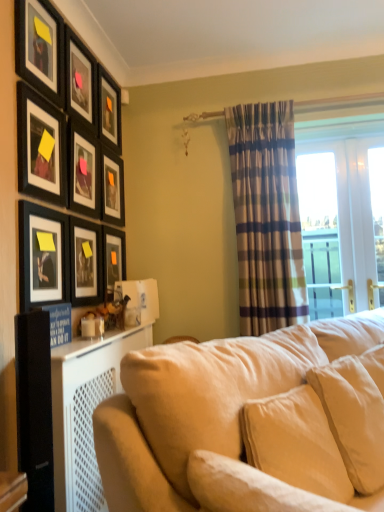
Where is `beige fabric couch at lower right`? The height and width of the screenshot is (512, 384). beige fabric couch at lower right is located at coordinates (246, 421).

Measure the distance between matte black picture frame at upper left, acting as the first picture frame starting from the top, and camera.

1.61 meters.

Describe the element at coordinates (266, 217) in the screenshot. This screenshot has height=512, width=384. I see `plaid fabric curtain at right` at that location.

Describe the element at coordinates (112, 188) in the screenshot. Image resolution: width=384 pixels, height=512 pixels. I see `matte black picture frame at upper left, acting as the 4th picture frame starting from the bottom` at that location.

Image resolution: width=384 pixels, height=512 pixels. In order to click on matte black picture frame at left, the 7th picture frame viewed from the top in this screenshot , I will do `click(43, 256)`.

Locate an element on the screen. beige fabric couch at lower right is located at coordinates pos(246,421).

From the image's perspective, is matte black picture frame at upper left, acting as the 6th picture frame starting from the top, above matte black picture frame at upper left, which is the eighth picture frame in bottom-to-top order?

No, from the image's perspective, matte black picture frame at upper left, acting as the 6th picture frame starting from the top, is not on top of matte black picture frame at upper left, which is the eighth picture frame in bottom-to-top order.

Is point (117, 186) positioned after point (76, 63)?

Yes, point (117, 186) is farther from viewer.

Could you tell me if matte black picture frame at upper left, acting as the 6th picture frame starting from the top, is turned towards matte black picture frame at upper left, which is the eighth picture frame in bottom-to-top order?

No, matte black picture frame at upper left, acting as the 6th picture frame starting from the top, is not turned towards matte black picture frame at upper left, which is the eighth picture frame in bottom-to-top order.

Who is shorter, matte black picture frame at upper left, the 9th picture frame ordered from the bottom, or matte black picture frame at upper left, the 1th picture frame in the bottom-to-top sequence?

Standing shorter between the two is matte black picture frame at upper left, the 9th picture frame ordered from the bottom.

Between matte black picture frame at upper left, the 9th picture frame ordered from the bottom, and matte black picture frame at upper left, positioned as the ninth picture frame in top-to-bottom order, which one has larger width?

With larger width is matte black picture frame at upper left, the 9th picture frame ordered from the bottom.

Who is bigger, matte black picture frame at upper left, acting as the first picture frame starting from the top, or matte black picture frame at upper left, positioned as the ninth picture frame in top-to-bottom order?

With larger size is matte black picture frame at upper left, acting as the first picture frame starting from the top.

Is there a large distance between beige fabric couch at lower right and matte black picture frame at left, the 8th picture frame viewed from the top?

Yes, beige fabric couch at lower right and matte black picture frame at left, the 8th picture frame viewed from the top, are located far from each other.

Is beige fabric couch at lower right bigger than matte black picture frame at left, acting as the 2th picture frame starting from the bottom?

Correct, beige fabric couch at lower right is larger in size than matte black picture frame at left, acting as the 2th picture frame starting from the bottom.

Between point (234, 352) and point (96, 231), which one is positioned behind?

The point (96, 231) is farther from the camera.

Measure the distance from beige fabric couch at lower right to matte black picture frame at left, the 8th picture frame viewed from the top.

beige fabric couch at lower right is 3.71 feet away from matte black picture frame at left, the 8th picture frame viewed from the top.

Which object is positioned more to the right, matte black picture frame at left, acting as the 2th picture frame starting from the bottom, or matte black picture frame at upper left, the 9th picture frame ordered from the bottom?

matte black picture frame at left, acting as the 2th picture frame starting from the bottom.

Is matte black picture frame at left, the 8th picture frame viewed from the top, thinner than matte black picture frame at upper left, acting as the first picture frame starting from the top?

Yes, matte black picture frame at left, the 8th picture frame viewed from the top, is thinner than matte black picture frame at upper left, acting as the first picture frame starting from the top.

Is matte black picture frame at left, the 8th picture frame viewed from the top, taller or shorter than matte black picture frame at upper left, the 9th picture frame ordered from the bottom?

matte black picture frame at left, the 8th picture frame viewed from the top, is taller than matte black picture frame at upper left, the 9th picture frame ordered from the bottom.

Would you say matte black picture frame at upper left, the fourth picture frame when ordered from top to bottom, is a long distance from beige fabric pillow at lower right, which is counted as the 2th pillow, starting from the back?

Yes, matte black picture frame at upper left, the fourth picture frame when ordered from top to bottom, and beige fabric pillow at lower right, which is counted as the 2th pillow, starting from the back, are quite far apart.

From their relative heights in the image, would you say matte black picture frame at upper left, which is counted as the sixth picture frame, starting from the bottom, is taller or shorter than beige fabric pillow at lower right, which is counted as the 2th pillow, starting from the back?

In the image, matte black picture frame at upper left, which is counted as the sixth picture frame, starting from the bottom, appears to be taller than beige fabric pillow at lower right, which is counted as the 2th pillow, starting from the back.

Consider the image. Could you tell me if matte black picture frame at upper left, which is counted as the sixth picture frame, starting from the bottom, is facing beige fabric pillow at lower right, acting as the 1th pillow starting from the front?

No, matte black picture frame at upper left, which is counted as the sixth picture frame, starting from the bottom, is not facing towards beige fabric pillow at lower right, acting as the 1th pillow starting from the front.

What's the angular difference between matte black picture frame at upper left, which is counted as the sixth picture frame, starting from the bottom, and beige fabric pillow at lower right, acting as the 1th pillow starting from the front,'s facing directions?

The angular difference between matte black picture frame at upper left, which is counted as the sixth picture frame, starting from the bottom, and beige fabric pillow at lower right, acting as the 1th pillow starting from the front, is 53.5 degrees.

Are matte black picture frame at upper left, the fourth picture frame when ordered from top to bottom, and matte black picture frame at upper left, the fifth picture frame positioned from the top, beside each other?

They are not placed beside each other.

Does matte black picture frame at upper left, which is counted as the sixth picture frame, starting from the bottom, have a larger size compared to matte black picture frame at upper left, the 5th picture frame from the bottom?

No, matte black picture frame at upper left, which is counted as the sixth picture frame, starting from the bottom, is not bigger than matte black picture frame at upper left, the 5th picture frame from the bottom.

How many degrees apart are the facing directions of matte black picture frame at upper left, which is counted as the sixth picture frame, starting from the bottom, and matte black picture frame at upper left, the fifth picture frame positioned from the top?

The angular difference between matte black picture frame at upper left, which is counted as the sixth picture frame, starting from the bottom, and matte black picture frame at upper left, the fifth picture frame positioned from the top, is 0.0139 degrees.

From a real-world perspective, is matte black picture frame at upper left, which is counted as the sixth picture frame, starting from the bottom, physically above matte black picture frame at upper left, the 5th picture frame from the bottom?

No, from a real-world perspective, matte black picture frame at upper left, which is counted as the sixth picture frame, starting from the bottom, is not over matte black picture frame at upper left, the 5th picture frame from the bottom

Would you say matte black picture frame at upper left, the 7th picture frame when ordered from bottom to top, is to the left or to the right of plaid fabric curtain at right in the picture?

Clearly, matte black picture frame at upper left, the 7th picture frame when ordered from bottom to top, is on the left of plaid fabric curtain at right in the image.

Considering the relative sizes of matte black picture frame at upper left, the third picture frame positioned from the top, and plaid fabric curtain at right in the image provided, is matte black picture frame at upper left, the third picture frame positioned from the top, shorter than plaid fabric curtain at right?

Correct, matte black picture frame at upper left, the third picture frame positioned from the top, is not as tall as plaid fabric curtain at right.

Which picture frame is the 3rd one when counting from the left side of the plaid fabric curtain at right? Please provide its 2D coordinates.

[(109, 110)]

The height and width of the screenshot is (512, 384). I want to click on the 4th picture frame counting from the right side of the matte black picture frame at upper left, which appears as the 2th picture frame when viewed from the top, so click(112, 188).

Starting from the matte black picture frame at upper left, the 1th picture frame in the bottom-to-top sequence, which picture frame is the 8th one to the left? Please provide its 2D coordinates.

[(40, 48)]

Considering their positions, is matte black picture frame at upper left, the fifth picture frame positioned from the top, positioned further to plaid fabric curtain at right than beige velvety pillow at center, which is the 1th pillow in back-to-front order?

Among the two, beige velvety pillow at center, which is the 1th pillow in back-to-front order, is located further to plaid fabric curtain at right.

Looking at the image, which one is located closer to matte black picture frame at left, the 7th picture frame viewed from the top, matte black picture frame at upper left, the third picture frame positioned from the top, or matte black picture frame at upper left, acting as the 6th picture frame starting from the top?

matte black picture frame at upper left, acting as the 6th picture frame starting from the top.

When comparing their distances from matte black picture frame at left, the 8th picture frame viewed from the top, does matte black picture frame at upper left, which appears as the 2th picture frame when viewed from the top, or matte black picture frame at upper left, the 9th picture frame ordered from the bottom, seem further?

Based on the image, matte black picture frame at upper left, the 9th picture frame ordered from the bottom, appears to be further to matte black picture frame at left, the 8th picture frame viewed from the top.

Which object lies further to the anchor point matte black picture frame at upper left, acting as the 6th picture frame starting from the top, matte black picture frame at upper left, acting as the first picture frame starting from the top, or plaid fabric curtain at right?

The object further to matte black picture frame at upper left, acting as the 6th picture frame starting from the top, is plaid fabric curtain at right.

Based on their spatial positions, is matte black picture frame at left, the 7th picture frame viewed from the top, or matte black picture frame at upper left, which appears as the 2th picture frame when viewed from the top, closer to matte black picture frame at upper left, acting as the 6th picture frame starting from the top?

Based on the image, matte black picture frame at upper left, which appears as the 2th picture frame when viewed from the top, appears to be nearer to matte black picture frame at upper left, acting as the 6th picture frame starting from the top.

Looking at the image, which one is located further to plaid fabric curtain at right, matte black picture frame at upper left, the 9th picture frame ordered from the bottom, or beige fabric pillow at lower right, acting as the 1th pillow starting from the front?

beige fabric pillow at lower right, acting as the 1th pillow starting from the front.

Which object lies nearer to the anchor point matte black picture frame at upper left, the fifth picture frame positioned from the top, matte black picture frame at upper left, which is the eighth picture frame in bottom-to-top order, or matte black picture frame at upper left, the 1th picture frame in the bottom-to-top sequence?

Among the two, matte black picture frame at upper left, which is the eighth picture frame in bottom-to-top order, is located nearer to matte black picture frame at upper left, the fifth picture frame positioned from the top.

Which object lies nearer to the anchor point matte black picture frame at upper left, the third picture frame positioned from the top, matte black picture frame at upper left, acting as the 4th picture frame starting from the bottom, or matte black picture frame at upper left, which is the eighth picture frame in bottom-to-top order?

Among the two, matte black picture frame at upper left, which is the eighth picture frame in bottom-to-top order, is located nearer to matte black picture frame at upper left, the third picture frame positioned from the top.

Where is `pillow between matte black picture frame at upper left, which is the eighth picture frame in bottom-to-top order, and beige velvety pillow at center, which is the 1th pillow in back-to-front order, in the vertical direction`? Image resolution: width=384 pixels, height=512 pixels. pillow between matte black picture frame at upper left, which is the eighth picture frame in bottom-to-top order, and beige velvety pillow at center, which is the 1th pillow in back-to-front order, in the vertical direction is located at coordinates (248, 488).

Image resolution: width=384 pixels, height=512 pixels. In order to click on curtain that lies between matte black picture frame at upper left, the 9th picture frame ordered from the bottom, and beige velvety pillow at center, positioned as the 2th pillow in front-to-back order, from top to bottom in this screenshot , I will do `click(266, 217)`.

At what (x,y) coordinates should I click in order to perform the action: click on pillow between matte black picture frame at left, the 7th picture frame viewed from the top, and beige velvety pillow at center, positioned as the 2th pillow in front-to-back order, from left to right. Please return your answer as a coordinate pair (x, y). Looking at the image, I should click on (248, 488).

Where is `curtain located between beige velvety pillow at center, which is the 1th pillow in back-to-front order, and matte black picture frame at upper left, the 7th picture frame when ordered from bottom to top, in the depth direction`? curtain located between beige velvety pillow at center, which is the 1th pillow in back-to-front order, and matte black picture frame at upper left, the 7th picture frame when ordered from bottom to top, in the depth direction is located at coordinates (266, 217).